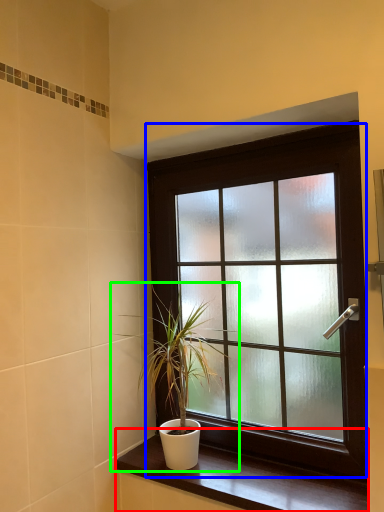
Question: Which object is the closest to the window sill (highlighted by a red box)? Choose among these: window (highlighted by a blue box) or houseplant (highlighted by a green box).

Choices:
 (A) window
 (B) houseplant

Answer: (B)